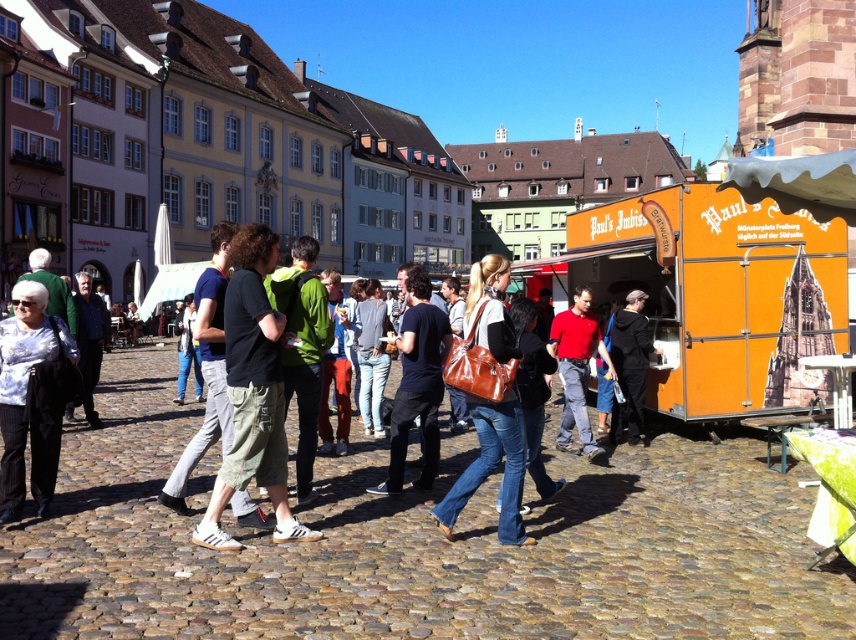
Question: Is orange matte food truck at center below black leather jacket at center?

Choices:
 (A) yes
 (B) no

Answer: (B)

Question: In this image, where is green cargo shorts at center located relative to black leather jacket at center?

Choices:
 (A) below
 (B) above

Answer: (B)

Question: Does brown leather bag at center appear on the left side of black leather jacket at center?

Choices:
 (A) yes
 (B) no

Answer: (A)

Question: Which object is positioned closest to the orange matte food truck at center?

Choices:
 (A) green cargo shorts at center
 (B) black leather jacket at center
 (C) white matte shirt at lower left

Answer: (B)

Question: Estimate the real-world distances between objects in this image. Which object is farther from the white matte shirt at lower left?

Choices:
 (A) red smooth shirt at center
 (B) green cargo shorts at center
 (C) brown leather bag at center
 (D) black matte shirt at center

Answer: (A)

Question: Which point is closer to the camera?

Choices:
 (A) black leather jacket at center
 (B) brown leather bag at center
 (C) green cargo shorts at center
 (D) black matte shirt at center

Answer: (C)